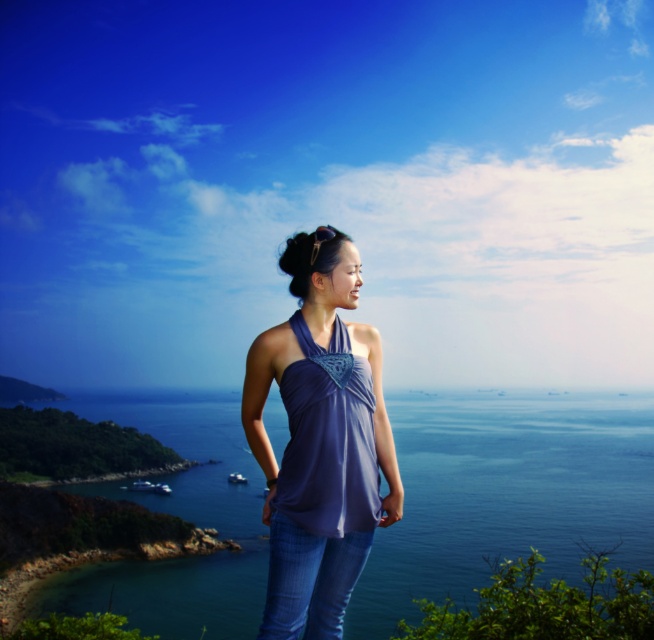
Question: Is blue water at center thinner than purple fabric top at center?

Choices:
 (A) yes
 (B) no

Answer: (B)

Question: Where is blue water at center located in relation to blue denim jeans at center in the image?

Choices:
 (A) above
 (B) below

Answer: (B)

Question: Is purple fabric top at center positioned at the back of blue denim jeans at center?

Choices:
 (A) yes
 (B) no

Answer: (A)

Question: Which of the following is the closest to the observer?

Choices:
 (A) purple fabric top at center
 (B) blue denim jeans at center
 (C) blue water at center

Answer: (B)

Question: Which of these objects is positioned farthest from the purple fabric top at center?

Choices:
 (A) blue denim jeans at center
 (B) blue water at center

Answer: (B)

Question: Which object is positioned farthest from the blue water at center?

Choices:
 (A) purple fabric top at center
 (B) blue denim jeans at center

Answer: (A)